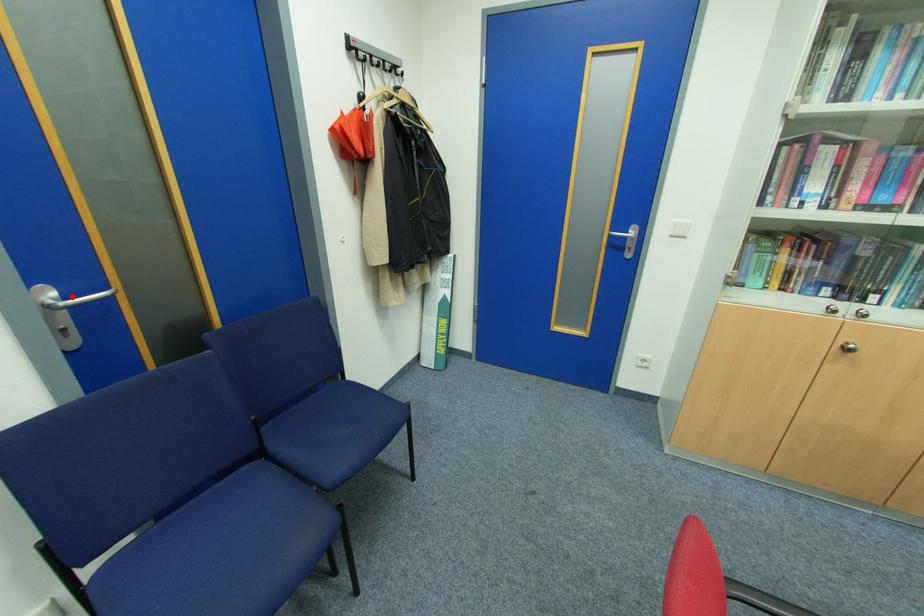
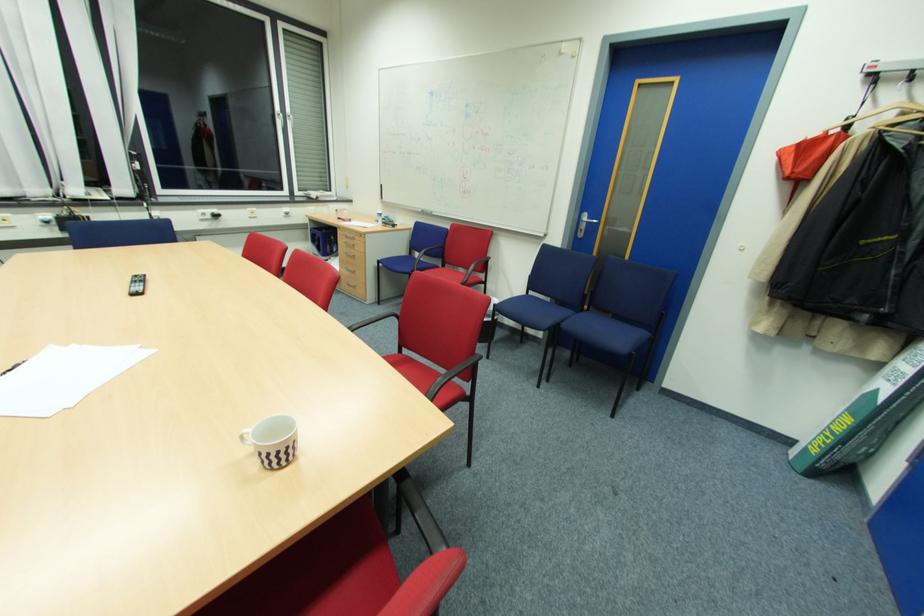
Question: I am providing you with two images of the same scene from different viewpoints. Image1 has a red point marked. In image2, the corresponding 3D location appears at what relative position? Reply with the corresponding letter.

Choices:
 (A) Closer
 (B) Farther

Answer: (A)